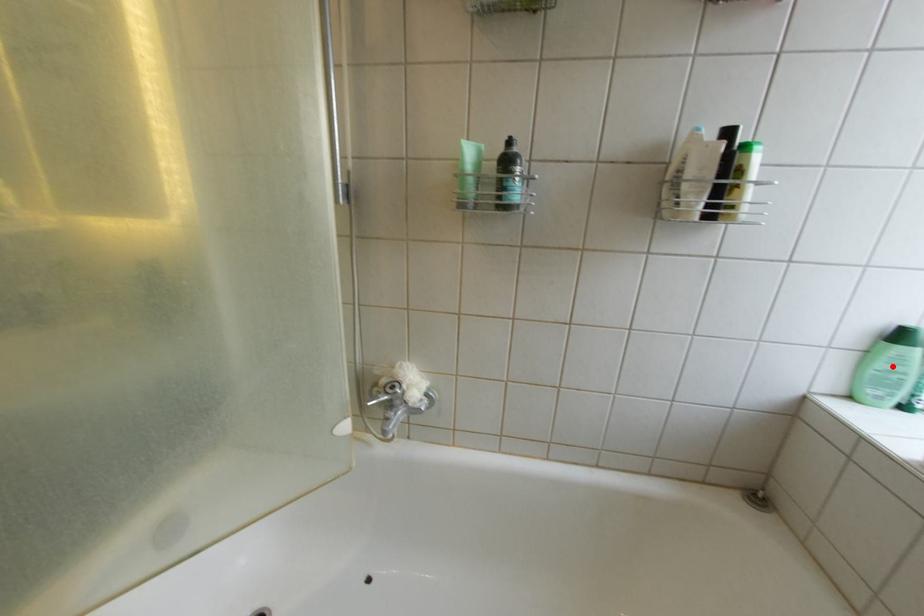
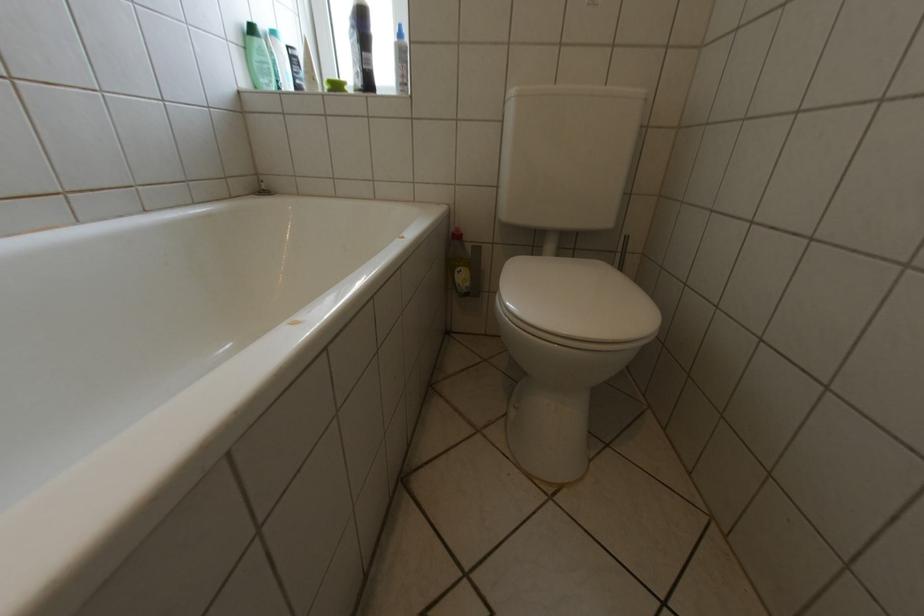
Where in the second image is the point corresponding to the highlighted location from the first image?

(268, 59)